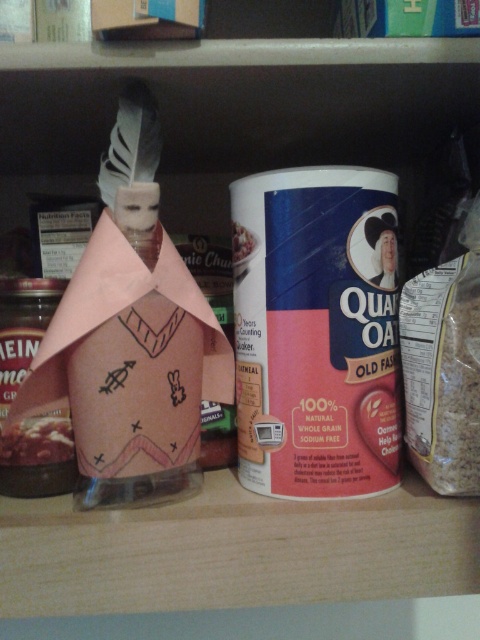
Measure the distance between matte plastic bottle at center and camera.

56.55 centimeters

Can you confirm if matte plastic bottle at center is positioned to the left of brown matte jar at center?

Correct, you'll find matte plastic bottle at center to the left of brown matte jar at center.

The width and height of the screenshot is (480, 640). Describe the element at coordinates (16, 388) in the screenshot. I see `matte plastic bottle at center` at that location.

At what (x,y) coordinates should I click in order to perform the action: click on matte plastic bottle at center. Please return your answer as a coordinate pair (x, y). Looking at the image, I should click on (16, 388).

Measure the distance from matte plastic bottle at center to smooth white rice at center.

They are 8.39 inches apart.

Which is below, matte plastic bottle at center or smooth white rice at center?

matte plastic bottle at center is lower down.

Measure the distance between matte plastic bottle at center and camera.

22.26 inches

Identify the location of matte plastic bottle at center. The height and width of the screenshot is (640, 480). (16, 388).

Based on the photo, is brown matte jar at center bigger than smooth white rice at center?

Incorrect, brown matte jar at center is not larger than smooth white rice at center.

Which is more to the right, brown matte jar at center or smooth white rice at center?

Positioned to the right is smooth white rice at center.

Is point (41, 440) closer to viewer compared to point (235, 240)?

Yes, point (41, 440) is closer to viewer.

At what (x,y) coordinates should I click in order to perform the action: click on brown matte jar at center. Please return your answer as a coordinate pair (x, y). Image resolution: width=480 pixels, height=640 pixels. Looking at the image, I should click on (36, 442).